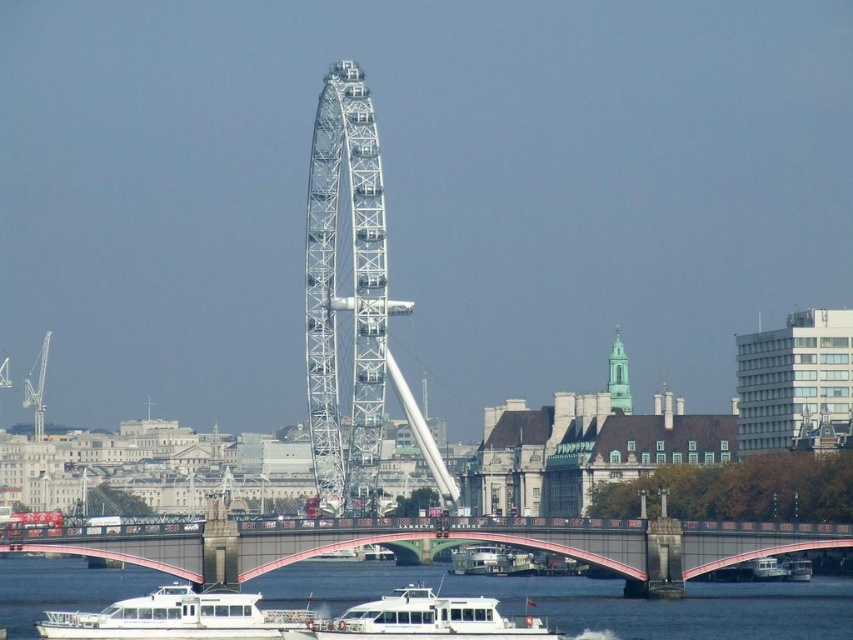
You are standing on the riverbank and want to take a photo of both the metallic pink bridge at center and the white matte boat at lower center. Which object should you adjust your camera focus to first to ensure both are in the frame?

You should focus on the metallic pink bridge at center first since it is closer to you than the white matte boat at lower center, allowing you to frame both objects properly.

You are a tour guide in London. You have a passenger who wants to take a photo of the metallic pink bridge at center from the white glossy boat at center. Can they do so if the camera has a maximum zoom range of 25 meters?

The metallic pink bridge at center is 26.07 meters from the white glossy boat at center. Since the distance is slightly beyond the camera maximum zoom range of 25 meters, the passenger cannot take the photo from the white glossy boat at center.